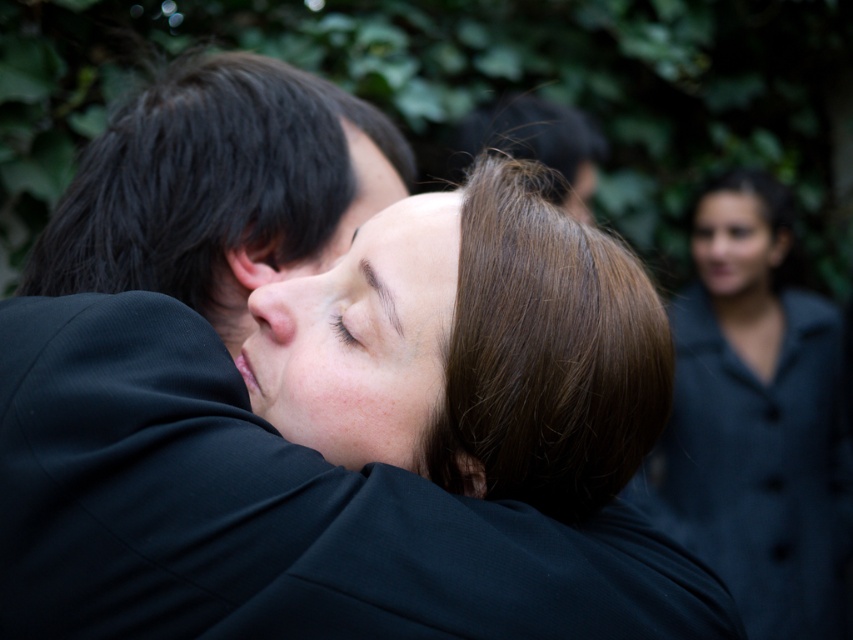
Question: Which object appears farthest from the camera in this image?

Choices:
 (A) smooth skin forehead at center
 (B) smooth skin face at center

Answer: (A)

Question: Which of the following is the closest to the observer?

Choices:
 (A) smooth skin forehead at center
 (B) matte black coat at upper right
 (C) smooth skin face at center
 (D) smooth black hair at center

Answer: (C)

Question: Can you confirm if matte black coat at upper right is positioned above smooth skin face at center?

Choices:
 (A) yes
 (B) no

Answer: (B)

Question: Considering the relative positions of matte black coat at upper right and smooth skin forehead at center in the image provided, where is matte black coat at upper right located with respect to smooth skin forehead at center?

Choices:
 (A) right
 (B) left

Answer: (A)

Question: Is smooth skin face at center closer to camera compared to smooth skin face at upper right?

Choices:
 (A) no
 (B) yes

Answer: (B)

Question: Among these objects, which one is nearest to the camera?

Choices:
 (A) smooth skin forehead at center
 (B) pink flesh-toned nose at center

Answer: (A)